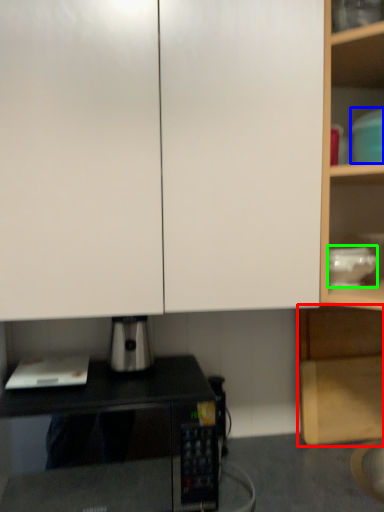
Question: Based on their relative distances, which object is nearer to cabinetry (highlighted by a red box)? Choose from appliance (highlighted by a blue box) and appliance (highlighted by a green box).

Choices:
 (A) appliance
 (B) appliance

Answer: (B)